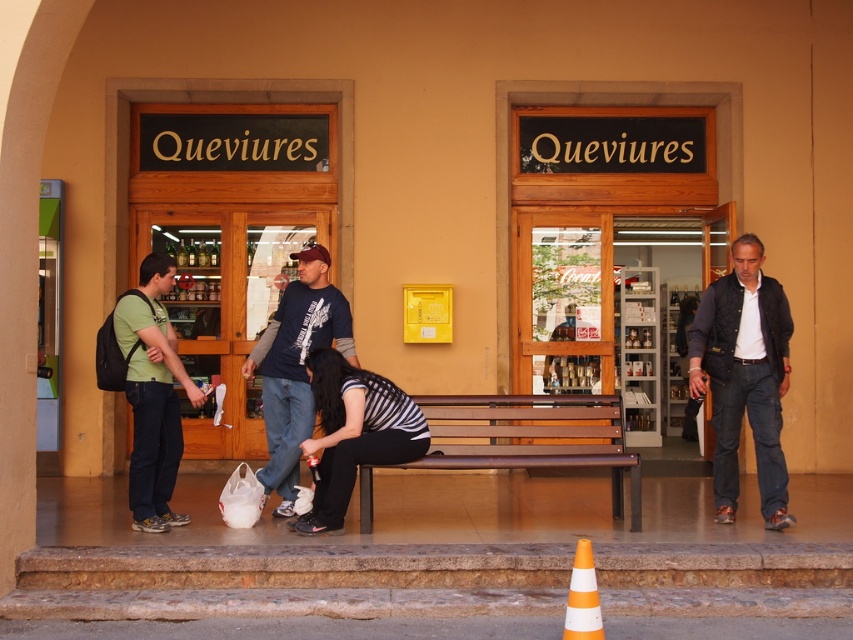
Can you confirm if matte green t-shirt at left is wider than dark blue t-shirt at center?

In fact, matte green t-shirt at left might be narrower than dark blue t-shirt at center.

Is point (131, 497) more distant than point (341, 355)?

No, (131, 497) is in front of (341, 355).

You are a GUI agent. You are given a task and a screenshot of the screen. Output one action in this format:
    pyautogui.click(x=<x>, y=<y>)
    Task: Click on the matte green t-shirt at left
    
    Given the screenshot: What is the action you would take?
    pyautogui.click(x=152, y=394)

Is brown stone stairs at lower center wider than brown wooden bench at center?

Yes.

Who is lower down, brown stone stairs at lower center or brown wooden bench at center?

brown stone stairs at lower center

Does point (787, 593) come in front of point (502, 460)?

Yes, it is in front of point (502, 460).

At what (x,y) coordinates should I click in order to perform the action: click on brown stone stairs at lower center. Please return your answer as a coordinate pair (x, y). Looking at the image, I should click on [x=288, y=580].

Which of these two, dark blue t-shirt at center or striped fabric shirt at center, stands shorter?

striped fabric shirt at center

Does dark blue t-shirt at center lie behind striped fabric shirt at center?

Yes, dark blue t-shirt at center is further from the viewer.

Measure the distance between point (277,426) and camera.

A distance of 6.54 meters exists between point (277,426) and camera.

Find the location of a particular element. This screenshot has width=853, height=640. dark blue t-shirt at center is located at coordinates (296, 368).